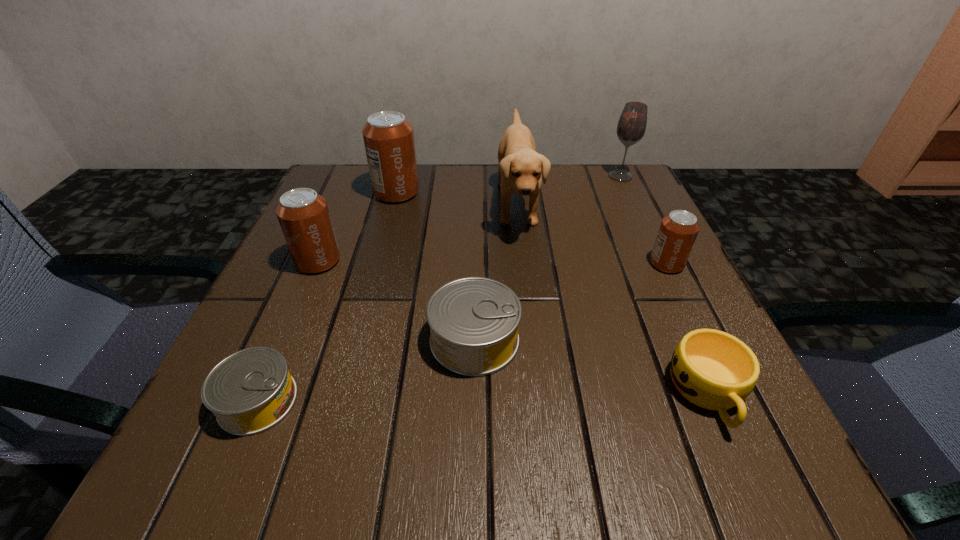
Locate an element on the screen. vacant space that's between the puppy and the biggest orange can is located at coordinates (457, 198).

Identify the location of object identified as the third closest to the rightmost orange can. Image resolution: width=960 pixels, height=540 pixels. (631, 127).

Identify which object is located as the fifth nearest to the third can from left to right. Please provide its 2D coordinates. Your answer should be formatted as a tuple, i.e. [(x, y)], where the tuple contains the x and y coordinates of a point satisfying the conditions above.

[(631, 127)]

What are the coordinates of `can that is the closest to the fourth shortest can` in the screenshot? It's located at (388, 137).

At what (x,y) coordinates should I click in order to perform the action: click on can that is the third closest one to the fifth tallest object. Please return your answer as a coordinate pair (x, y). The width and height of the screenshot is (960, 540). Looking at the image, I should click on (303, 215).

This screenshot has width=960, height=540. In order to click on orange can that can be found as the second closest to the third object from left to right in this screenshot , I will do `click(678, 231)`.

Locate an element on the screen. Image resolution: width=960 pixels, height=540 pixels. orange can that is the third closest to the smaller silver can is located at coordinates (678, 231).

The height and width of the screenshot is (540, 960). I want to click on free space that satisfies the following two spatial constraints: 1. on the left side of the beige puppy; 2. on the left side of the smallest orange can, so click(x=523, y=264).

The width and height of the screenshot is (960, 540). In order to click on vacant position in the image that satisfies the following two spatial constraints: 1. on the front side of the glass drink container; 2. on the left side of the puppy in this screenshot , I will do `click(633, 203)`.

The height and width of the screenshot is (540, 960). Identify the location of blank space that satisfies the following two spatial constraints: 1. on the front side of the smallest orange can; 2. on the right side of the second smallest orange can. (317, 264).